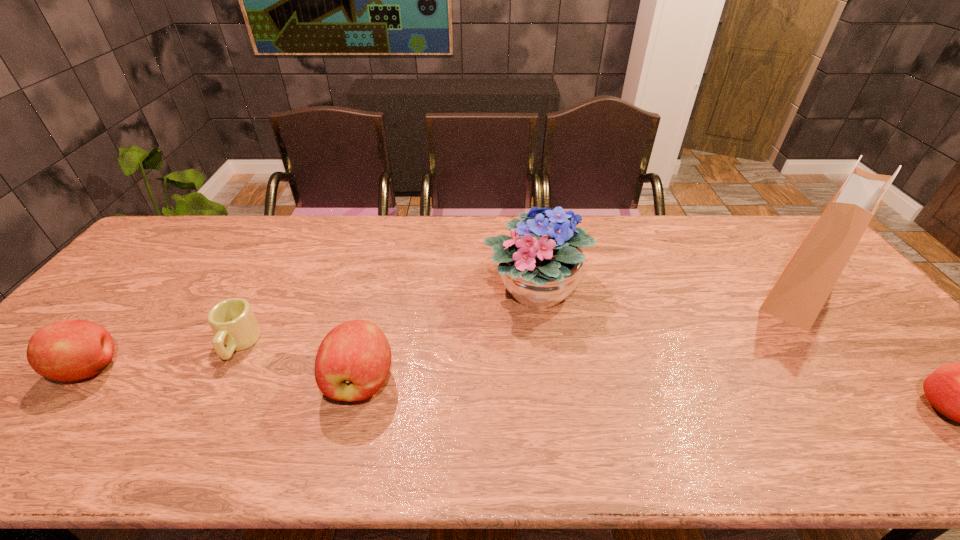
Find the location of a particular element. the fourth tallest object is located at coordinates (68, 350).

Identify the location of the leftmost object. (68, 350).

Find the location of a particular element. the third object from left to right is located at coordinates (353, 361).

This screenshot has height=540, width=960. What are the coordinates of `the shortest object` in the screenshot? It's located at (232, 320).

Find the location of `mug`. mug is located at coordinates (232, 320).

At what (x,y) coordinates should I click in order to perform the action: click on the tallest object. Please return your answer as a coordinate pair (x, y). Looking at the image, I should click on (801, 291).

This screenshot has width=960, height=540. I want to click on bouquet, so click(x=540, y=267).

In order to click on the fifth shortest object in this screenshot , I will do `click(540, 267)`.

Locate an element on the screen. This screenshot has height=540, width=960. vacant space situated 0.400m on the right of the leftmost object is located at coordinates (286, 369).

This screenshot has width=960, height=540. In order to click on vacant space situated 0.360m on the back of the second apple from right to left in this screenshot , I will do `click(390, 262)`.